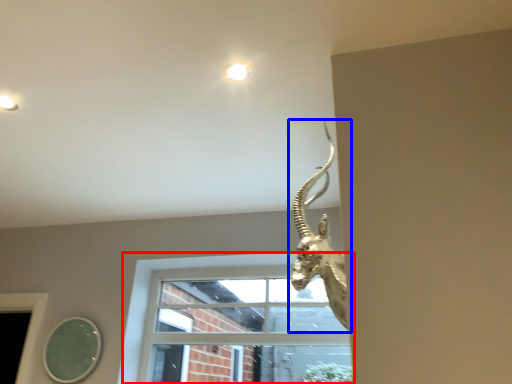
Question: Among these objects, which one is nearest to the camera, window (highlighted by a red box) or animal (highlighted by a blue box)?

Choices:
 (A) window
 (B) animal

Answer: (B)